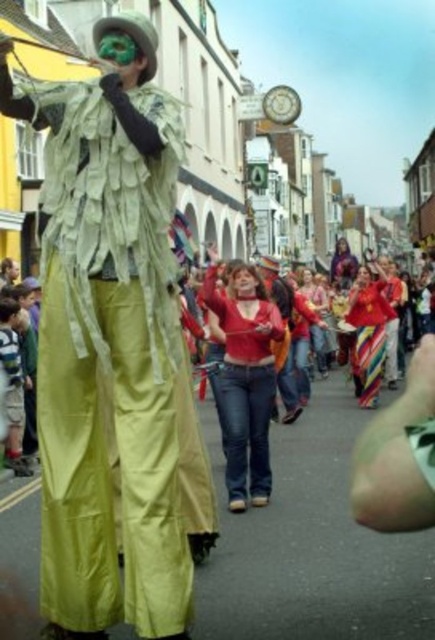
Question: Which object appears farthest from the camera in this image?

Choices:
 (A) matte red sweater at center
 (B) multicolored striped pants at center
 (C) smooth skin face at center
 (D) green fabric costume at center

Answer: (B)

Question: Does green fabric costume at center have a larger size compared to multicolored striped pants at center?

Choices:
 (A) yes
 (B) no

Answer: (A)

Question: Which object appears farthest from the camera in this image?

Choices:
 (A) smooth skin face at center
 (B) multicolored striped pants at center
 (C) matte red sweater at center

Answer: (B)

Question: Does multicolored striped pants at center have a larger size compared to smooth skin face at center?

Choices:
 (A) yes
 (B) no

Answer: (A)

Question: Which point is farther to the camera?

Choices:
 (A) smooth skin face at center
 (B) multicolored striped pants at center
 (C) green fabric costume at center

Answer: (B)

Question: Does green fabric costume at center appear under smooth skin face at center?

Choices:
 (A) no
 (B) yes

Answer: (B)